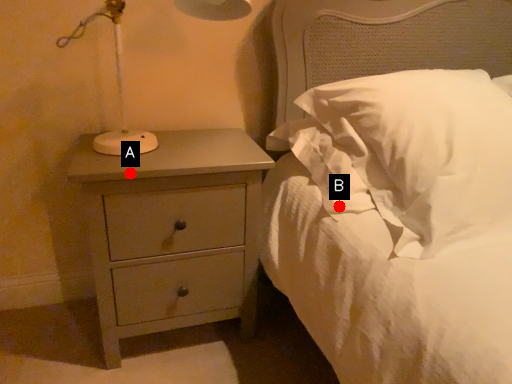
Question: Two points are circled on the image, labeled by A and B beside each circle. Which point is farther from the camera taking this photo?

Choices:
 (A) A is further
 (B) B is further

Answer: (B)